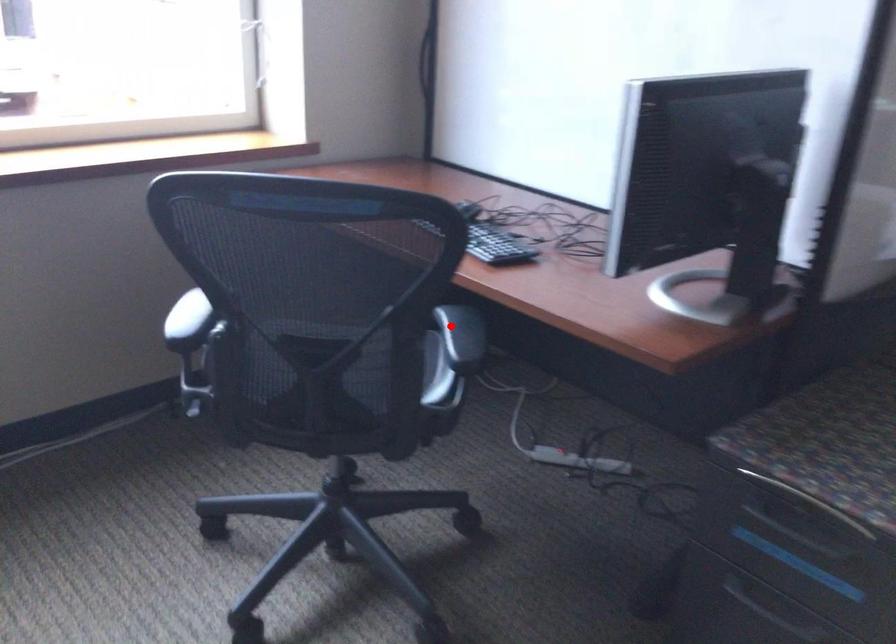
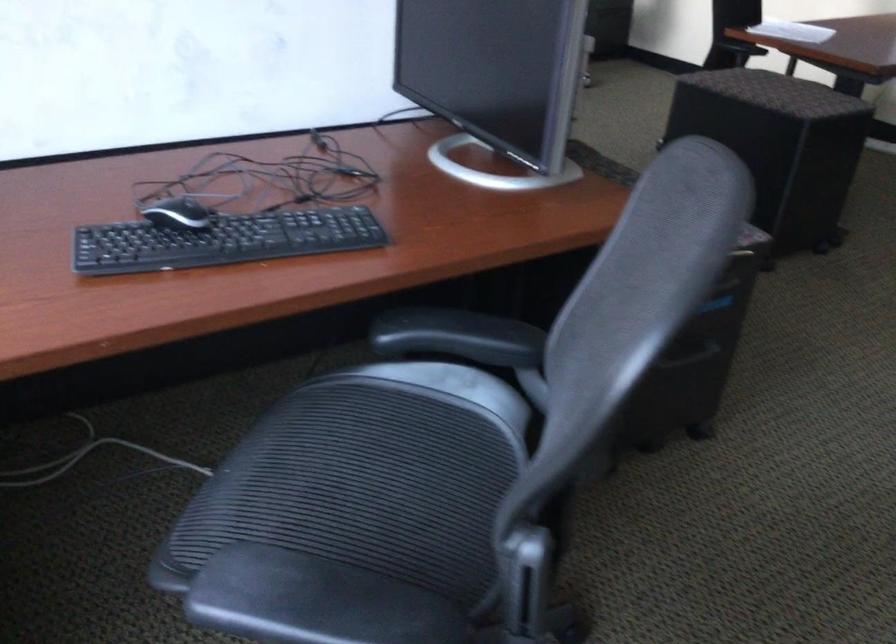
Locate, in the second image, the point that corresponds to the highlighted location in the first image.

(458, 337)